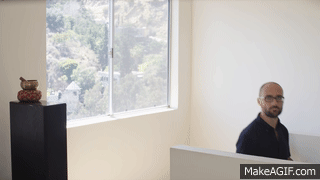
Find the location of `stair railing`. stair railing is located at coordinates (272, 146).